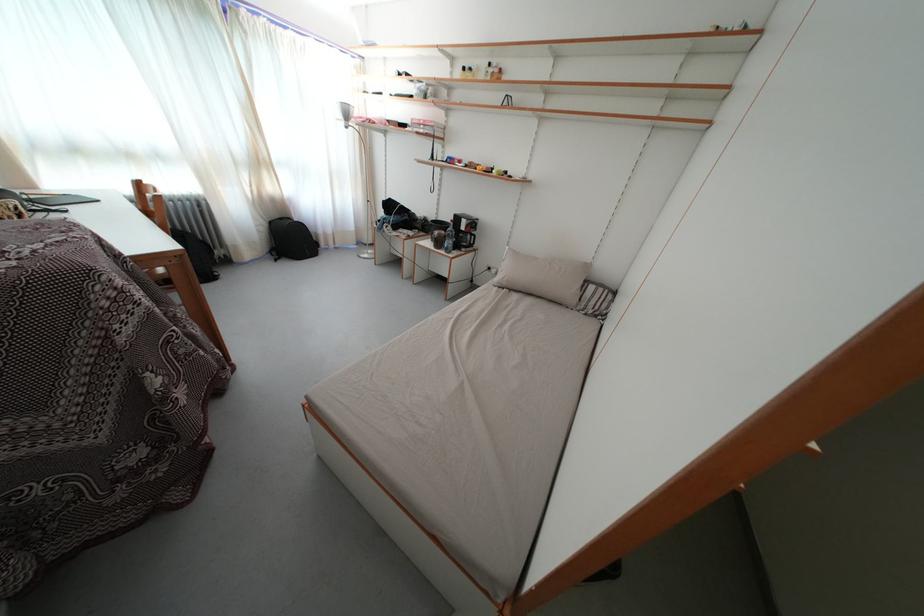
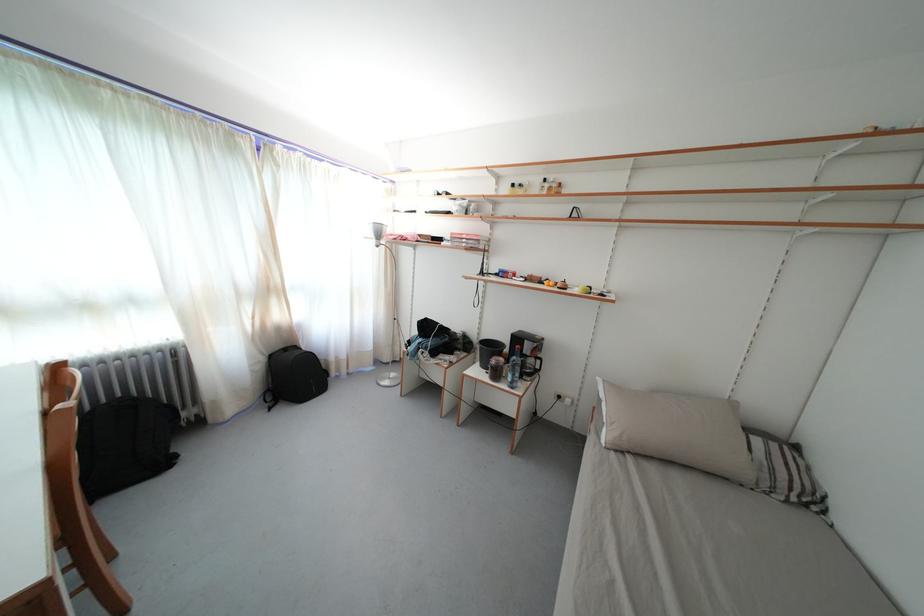
In the second image, find the point that corresponds to pixel 511 290 in the first image.

(630, 452)